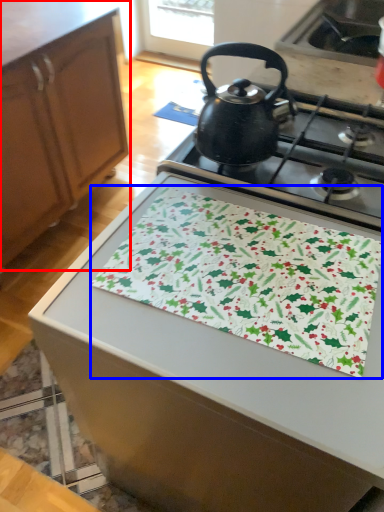
Question: Which object is closer to the camera taking this photo, cabinetry (highlighted by a red box) or blanket (highlighted by a blue box)?

Choices:
 (A) cabinetry
 (B) blanket

Answer: (B)